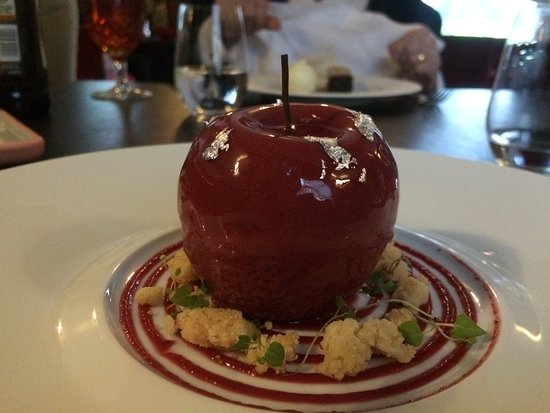
Identify the location of water glasses. (520, 120), (208, 73).